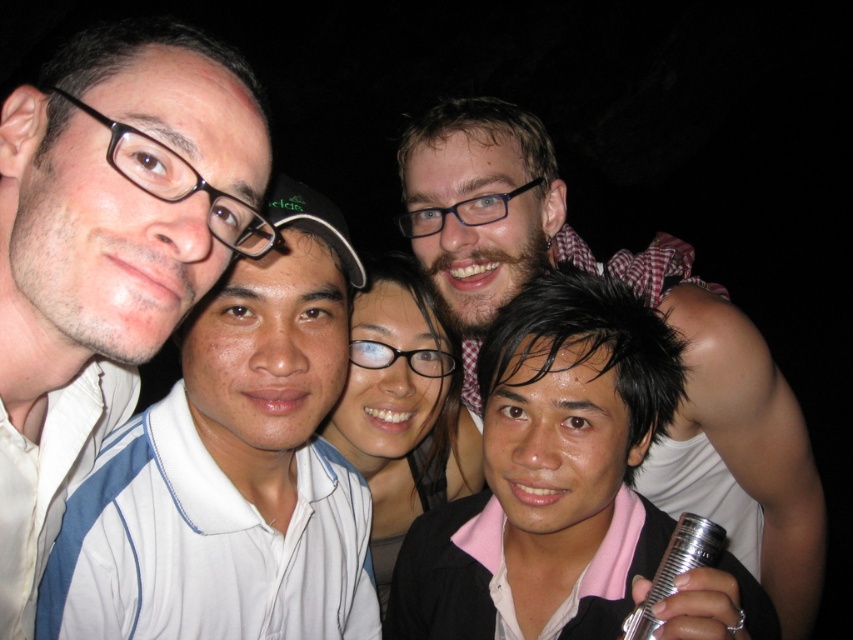
Question: Can you confirm if matte white shirt at left is wider than bearded man at center?

Choices:
 (A) yes
 (B) no

Answer: (B)

Question: Can you confirm if matte white shirt at left is wider than bearded man at center?

Choices:
 (A) yes
 (B) no

Answer: (B)

Question: In this image, where is matte white shirt at left located relative to bearded man at center?

Choices:
 (A) left
 (B) right

Answer: (A)

Question: Which object appears farthest from the camera in this image?

Choices:
 (A) bearded man at center
 (B) matte white shirt at left

Answer: (A)

Question: Which object appears farthest from the camera in this image?

Choices:
 (A) bearded man at center
 (B) matte white shirt at left

Answer: (A)